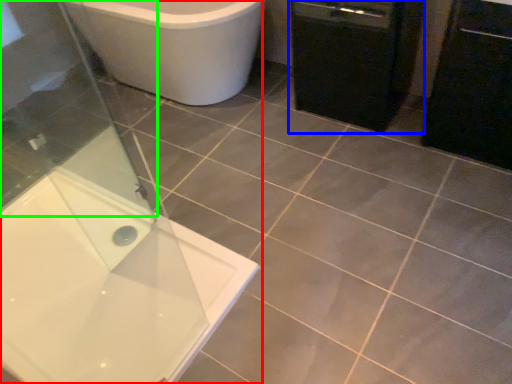
Question: Estimate the real-world distances between objects in this image. Which object is closer to bathtub (highlighted by a red box), dish washer (highlighted by a blue box) or screen door (highlighted by a green box)?

Choices:
 (A) dish washer
 (B) screen door

Answer: (B)